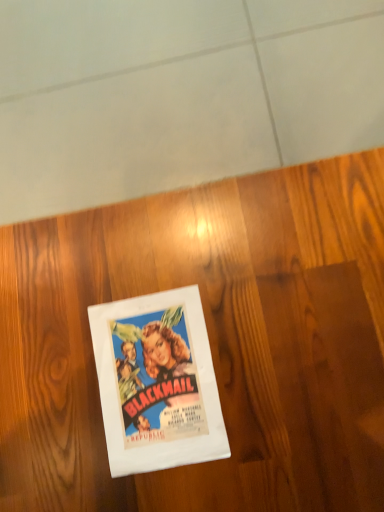
The image size is (384, 512). I want to click on vacant space to the right of white paper at center, so click(x=264, y=313).